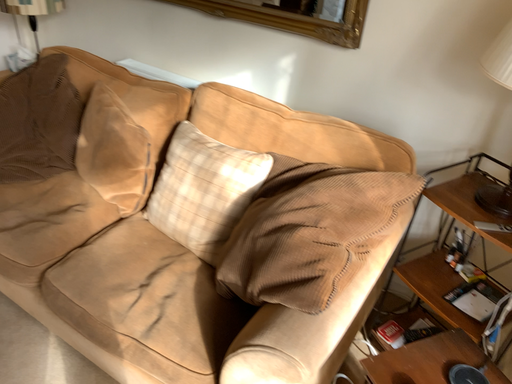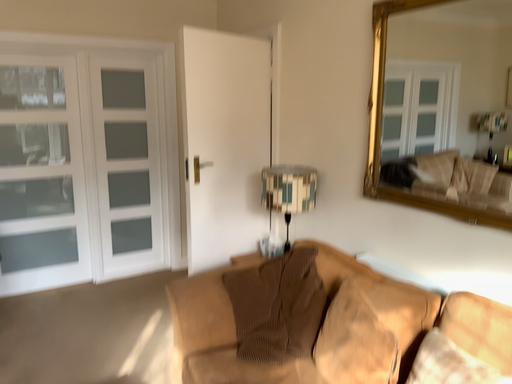
Question: How did the camera likely rotate when shooting the video?

Choices:
 (A) rotated right
 (B) rotated left

Answer: (B)